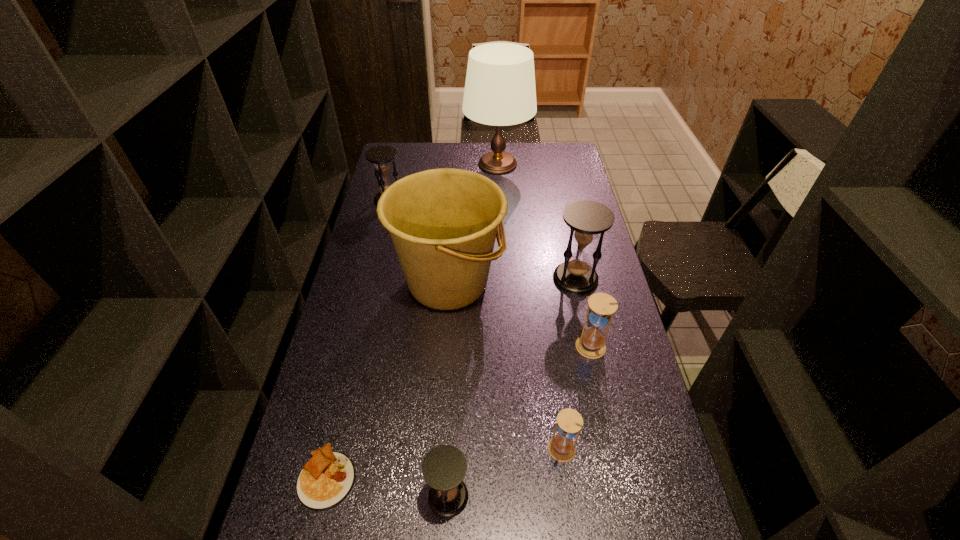
Where is `the fourth hourglass from right to left`? The width and height of the screenshot is (960, 540). the fourth hourglass from right to left is located at coordinates (444, 468).

Where is `the second nearest hourglass`? The width and height of the screenshot is (960, 540). the second nearest hourglass is located at coordinates (561, 447).

This screenshot has width=960, height=540. I want to click on the third hourglass from left to right, so click(561, 447).

Where is `the shortest object`? The height and width of the screenshot is (540, 960). the shortest object is located at coordinates (325, 481).

At what (x,y) coordinates should I click in order to perform the action: click on free space located on the left of the tallest object. Please return your answer as a coordinate pair (x, y). Image resolution: width=960 pixels, height=540 pixels. Looking at the image, I should click on (403, 164).

What are the coordinates of `free space located 0.290m on the side of the second tallest object with the handle` in the screenshot? It's located at (588, 282).

Where is `vacant space positioned on the front of the second farthest black hourglass`? vacant space positioned on the front of the second farthest black hourglass is located at coordinates (600, 392).

You are a GUI agent. You are given a task and a screenshot of the screen. Output one action in this format:
    pyautogui.click(x=<x>, y=<y>)
    Task: Click on the vacant space positioned 0.240m on the front of the leftmost hourglass
    The image size is (960, 540).
    Given the screenshot: What is the action you would take?
    pyautogui.click(x=377, y=247)

You are a GUI agent. You are given a task and a screenshot of the screen. Output one action in this format:
    pyautogui.click(x=<x>, y=<y>)
    Task: Click on the vacant space situated on the back of the right white hourglass
    The width and height of the screenshot is (960, 540).
    Given the screenshot: What is the action you would take?
    pyautogui.click(x=581, y=300)

The image size is (960, 540). Identify the location of free location located on the right of the nearest hourglass. (590, 496).